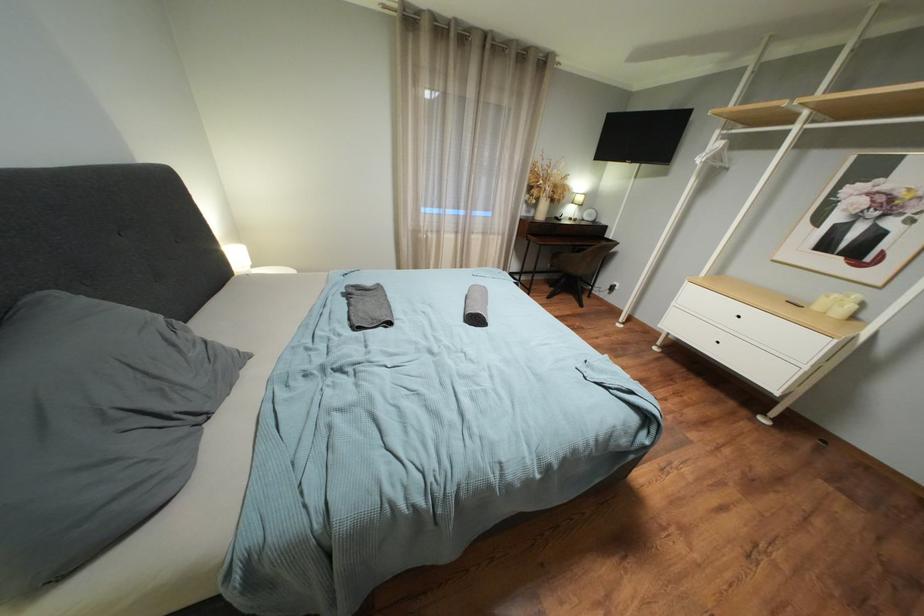
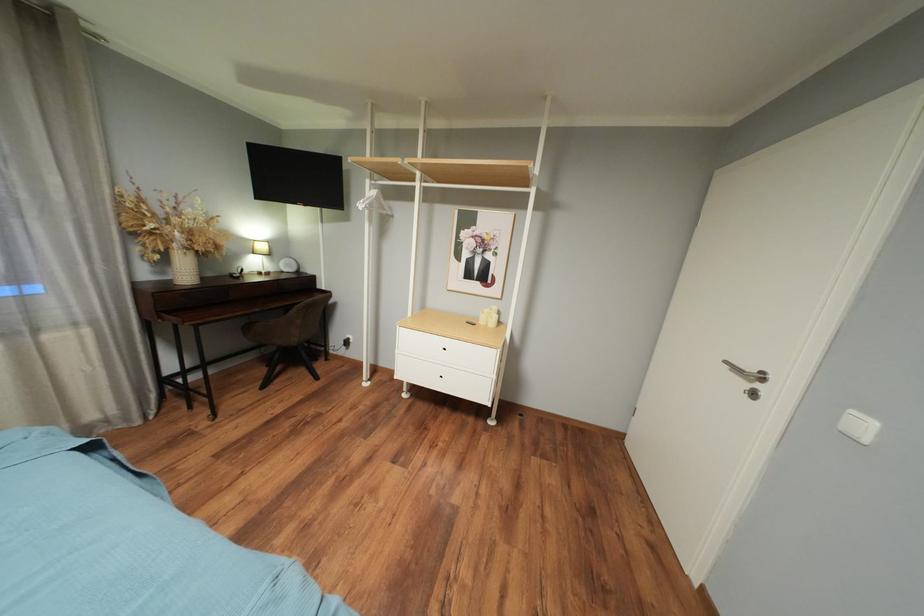
Question: The images are taken continuously from a first-person perspective. In which direction is your viewpoint rotating?

Choices:
 (A) Left
 (B) Right
 (C) Up
 (D) Down

Answer: (B)